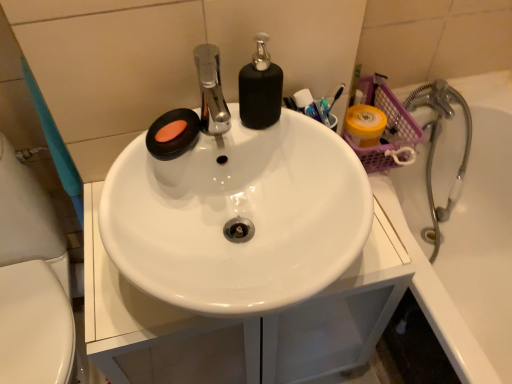
Question: Considering the relative positions of metallic silver faucet at right and white glossy sink at center in the image provided, is metallic silver faucet at right to the left or to the right of white glossy sink at center?

Choices:
 (A) right
 (B) left

Answer: (A)

Question: From a real-world perspective, relative to white glossy sink at center, is metallic silver faucet at right vertically above or below?

Choices:
 (A) below
 (B) above

Answer: (A)

Question: Based on their relative distances, which object is farther from the matte black soap at upper left?

Choices:
 (A) white glossy sink at center
 (B) metallic silver faucet at right
 (C) white glossy sink at left
 (D) black matte soap dispenser at center

Answer: (B)

Question: Which object is positioned farthest from the white glossy sink at left?

Choices:
 (A) matte black soap at upper left
 (B) white glossy sink at center
 (C) black matte soap dispenser at center
 (D) metallic silver faucet at right

Answer: (D)